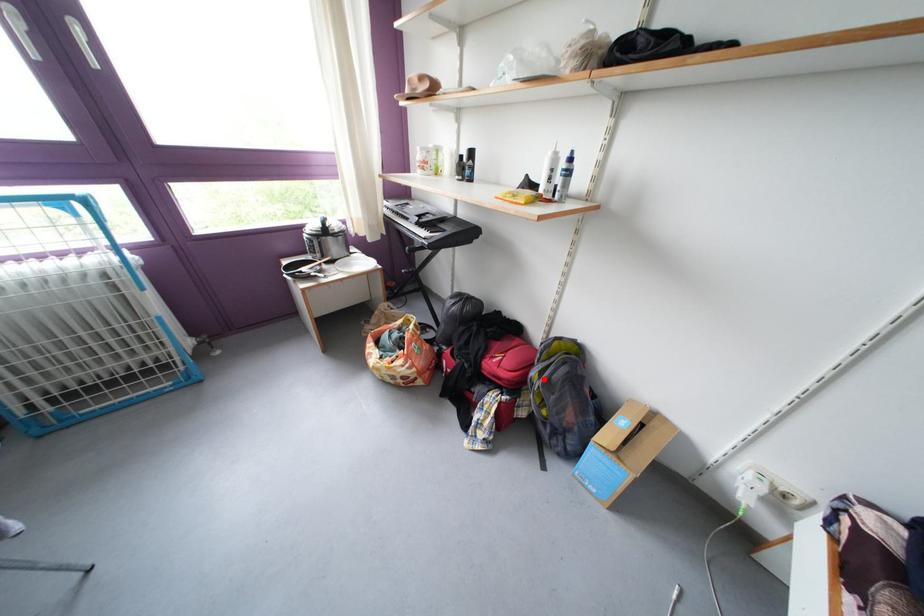
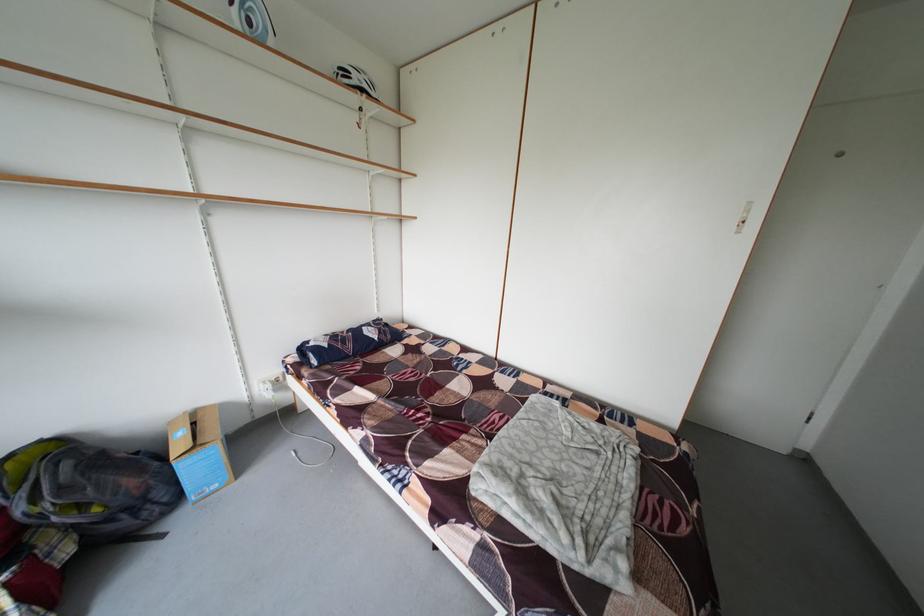
Find the pixel in the second image that matches the highlighted location in the first image.

(31, 515)